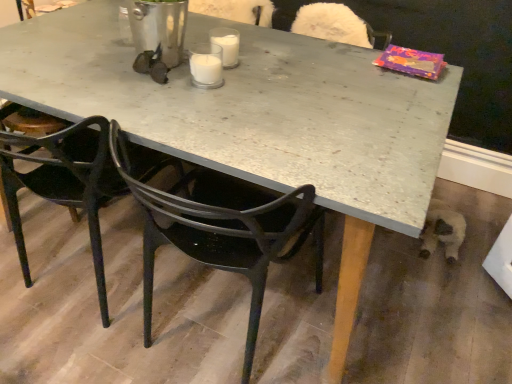
This screenshot has height=384, width=512. Identify the location of vacant point to the right of black plastic chair at center, which ranks as the 2th chair in left-to-right order. click(x=370, y=316).